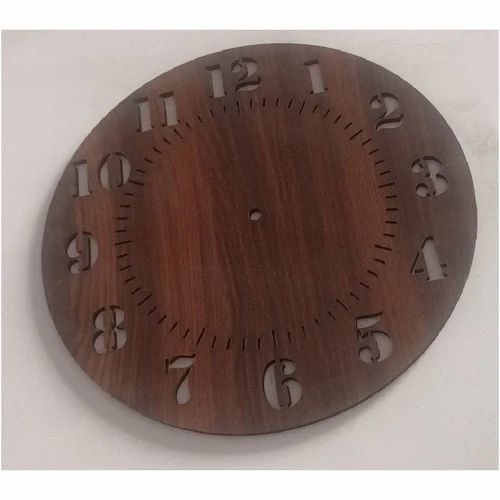
Find the location of a particular element. The height and width of the screenshot is (500, 500). clock face's shadow is located at coordinates (129, 421).